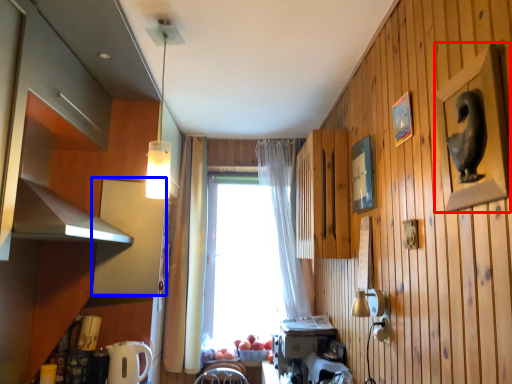
Question: Among these objects, which one is farthest to the camera, picture frame (highlighted by a red box) or cabinetry (highlighted by a blue box)?

Choices:
 (A) picture frame
 (B) cabinetry

Answer: (B)